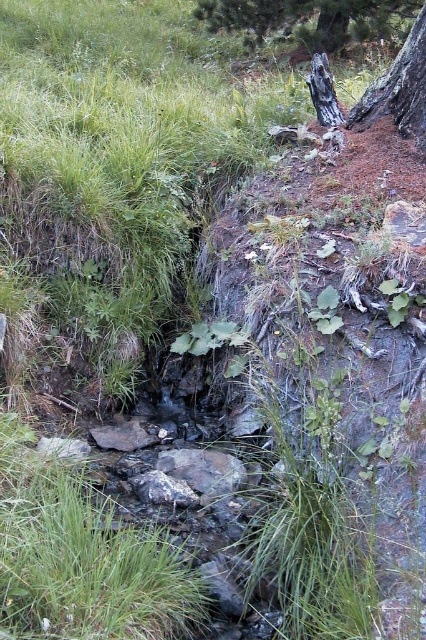
This screenshot has height=640, width=426. I want to click on green textured tree at upper center, so click(x=308, y=19).

Does point (310, 1) lie in front of point (368, 102)?

That is False.

Is point (250, 4) closer to camera compared to point (405, 42)?

No, (250, 4) is behind (405, 42).

At what (x,y) coordinates should I click in order to perform the action: click on green textured tree at upper center. Please return your answer as a coordinate pair (x, y). Image resolution: width=426 pixels, height=640 pixels. Looking at the image, I should click on (308, 19).